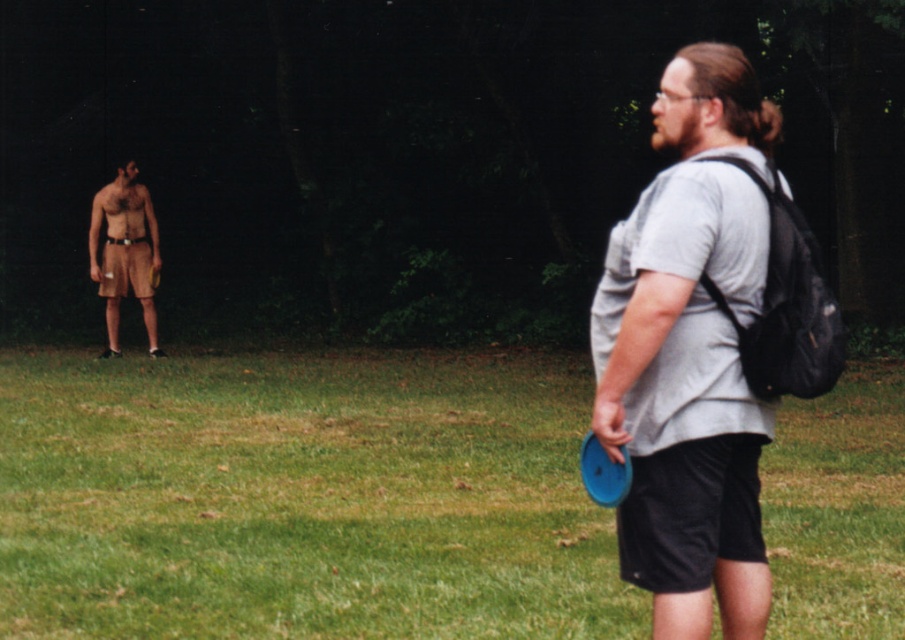
Is gray matte t-shirt at center smaller than blue plastic frisbee at right?

No, gray matte t-shirt at center is not smaller than blue plastic frisbee at right.

Does gray matte t-shirt at center appear under blue plastic frisbee at right?

No, gray matte t-shirt at center is not below blue plastic frisbee at right.

You are a GUI agent. You are given a task and a screenshot of the screen. Output one action in this format:
    pyautogui.click(x=<x>, y=<y>)
    Task: Click on the gray matte t-shirt at center
    The height and width of the screenshot is (640, 905).
    Given the screenshot: What is the action you would take?
    pyautogui.click(x=691, y=353)

Is green grass at center above gray matte t-shirt at center?

No.

Is green grass at center wider than gray matte t-shirt at center?

Correct, the width of green grass at center exceeds that of gray matte t-shirt at center.

Measure the distance between green grass at center and camera.

green grass at center and camera are 5.21 meters apart.

The width and height of the screenshot is (905, 640). What are the coordinates of `green grass at center` in the screenshot? It's located at (302, 499).

Is point (735, 596) positioned before point (113, 316)?

Yes.

Is gray matte t-shirt at center positioned behind brown fabric shorts at left?

No, gray matte t-shirt at center is closer to the viewer.

The height and width of the screenshot is (640, 905). What do you see at coordinates (691, 353) in the screenshot?
I see `gray matte t-shirt at center` at bounding box center [691, 353].

Where is `gray matte t-shirt at center`? This screenshot has height=640, width=905. gray matte t-shirt at center is located at coordinates (691, 353).